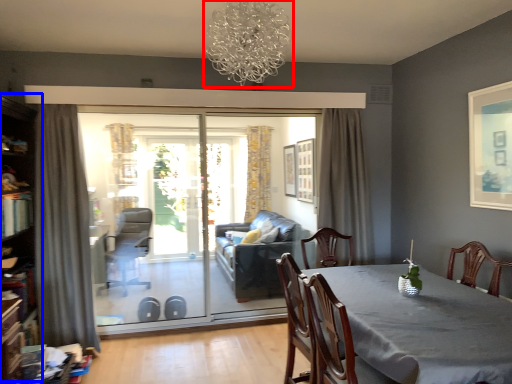
Question: Which of the following is the closest to the observer, light fixture (highlighted by a red box) or bookshelf (highlighted by a blue box)?

Choices:
 (A) light fixture
 (B) bookshelf

Answer: (A)